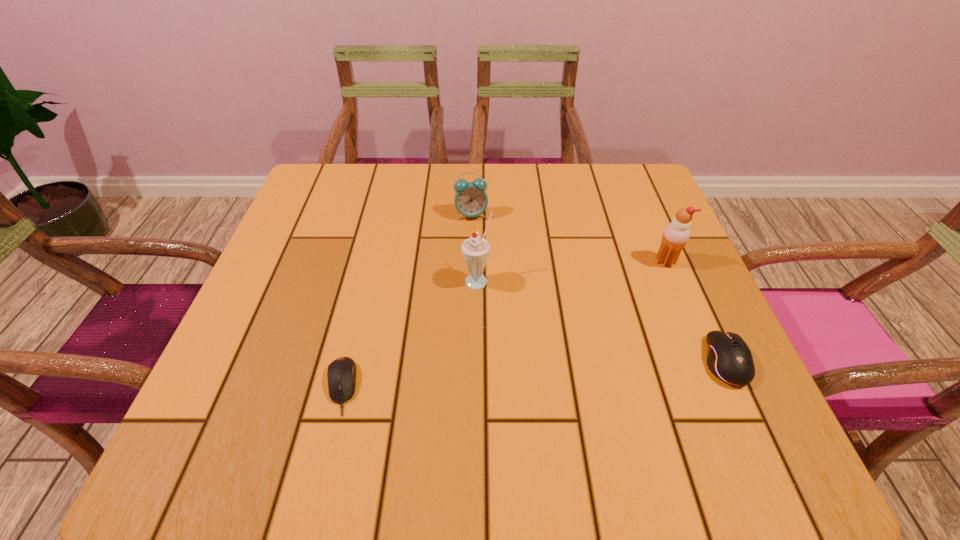
Where is `unoccupied area between the icecream and the third tallest object`? The width and height of the screenshot is (960, 540). unoccupied area between the icecream and the third tallest object is located at coordinates (568, 238).

At what (x,y) coordinates should I click in order to perform the action: click on object that can be found as the closest to the icecream. Please return your answer as a coordinate pair (x, y). Image resolution: width=960 pixels, height=540 pixels. Looking at the image, I should click on (729, 358).

Find the location of a particular element. The image size is (960, 540). the second closest object to the leftmost object is located at coordinates (470, 198).

You are a GUI agent. You are given a task and a screenshot of the screen. Output one action in this format:
    pyautogui.click(x=<x>, y=<y>)
    Task: Click on the vacant space that satisfies the following two spatial constraints: 1. on the back side of the milkshake; 2. on the right side of the shorter computer mouse
    The width and height of the screenshot is (960, 540).
    Given the screenshot: What is the action you would take?
    pyautogui.click(x=367, y=280)

Locate an element on the screen. vacant space that satisfies the following two spatial constraints: 1. on the front side of the taller computer mouse; 2. on the left side of the milkshake is located at coordinates (477, 362).

Where is `free point that satisfies the following two spatial constraints: 1. on the front side of the milkshake; 2. on the left side of the alarm clock`? free point that satisfies the following two spatial constraints: 1. on the front side of the milkshake; 2. on the left side of the alarm clock is located at coordinates (469, 280).